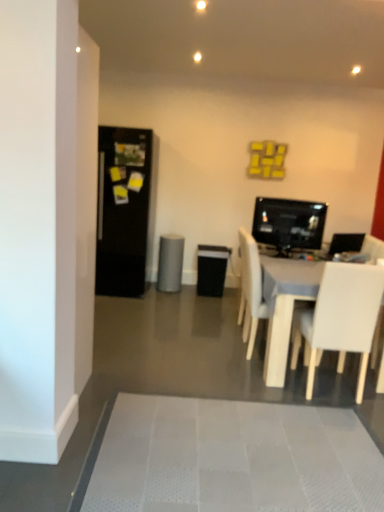
Question: From a real-world perspective, is gray matte speaker at center on white textured bath mat at lower center?

Choices:
 (A) yes
 (B) no

Answer: (A)

Question: Is gray matte speaker at center aimed at white textured bath mat at lower center?

Choices:
 (A) yes
 (B) no

Answer: (A)

Question: Is gray matte speaker at center positioned in front of white textured bath mat at lower center?

Choices:
 (A) yes
 (B) no

Answer: (B)

Question: From the image's perspective, is gray matte speaker at center under white textured bath mat at lower center?

Choices:
 (A) no
 (B) yes

Answer: (A)

Question: Is gray matte speaker at center smaller than white textured bath mat at lower center?

Choices:
 (A) no
 (B) yes

Answer: (A)

Question: Based on their sizes in the image, would you say white textured bath mat at lower center is bigger or smaller than gray matte speaker at center?

Choices:
 (A) small
 (B) big

Answer: (A)

Question: Considering the positions of point (256, 467) and point (168, 246), is point (256, 467) closer or farther from the camera than point (168, 246)?

Choices:
 (A) farther
 (B) closer

Answer: (B)

Question: From their relative heights in the image, would you say white textured bath mat at lower center is taller or shorter than gray matte speaker at center?

Choices:
 (A) short
 (B) tall

Answer: (A)

Question: Relative to gray matte speaker at center, is white textured bath mat at lower center in front or behind?

Choices:
 (A) front
 (B) behind

Answer: (A)

Question: In terms of size, does matte black monitor at center right appear bigger or smaller than white matte chair at lower right, marked as the first chair in a front-to-back arrangement?

Choices:
 (A) small
 (B) big

Answer: (A)

Question: In terms of height, does matte black monitor at center right look taller or shorter compared to white matte chair at lower right, marked as the first chair in a front-to-back arrangement?

Choices:
 (A) short
 (B) tall

Answer: (A)

Question: Visually, is matte black monitor at center right positioned to the left or to the right of white matte chair at lower right, marked as the first chair in a front-to-back arrangement?

Choices:
 (A) right
 (B) left

Answer: (B)

Question: From a real-world perspective, is matte black monitor at center right physically located above or below white matte chair at lower right, marked as the first chair in a front-to-back arrangement?

Choices:
 (A) below
 (B) above

Answer: (B)

Question: Is gray matte speaker at center to the left or to the right of black matte refrigerator at left in the image?

Choices:
 (A) right
 (B) left

Answer: (A)

Question: Looking at their shapes, would you say gray matte speaker at center is wider or thinner than black matte refrigerator at left?

Choices:
 (A) thin
 (B) wide

Answer: (A)